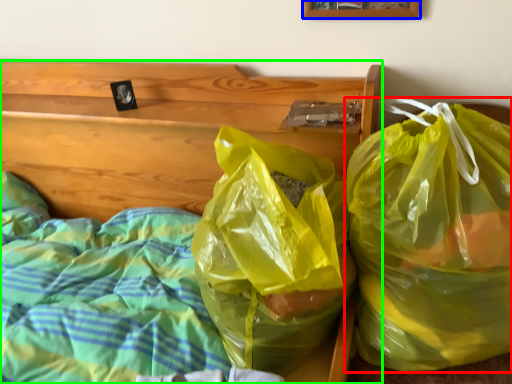
Question: Estimate the real-world distances between objects in this image. Which object is farther from plastic bag (highlighted by a red box), picture frame (highlighted by a blue box) or furniture (highlighted by a green box)?

Choices:
 (A) picture frame
 (B) furniture

Answer: (A)